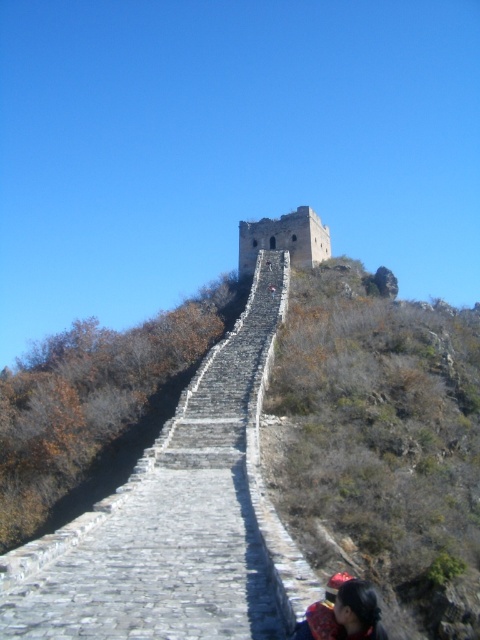
You are a hiker standing at the lower right of the image, near the dark brown hair at lower right. You want to reach the stone wall at upper center. Which direction should you move to get there?

The stone wall at upper center is positioned on the right side of dark brown hair at lower right. To reach it, you should move towards the right direction from your current position near the dark brown hair at lower right.

Based on the photo, you are a hiker standing at the base of the Great Wall and want to reach the watchtower at the top. You notice the stone wall at upper center and the dark brown hair at lower right. Which object is taller and could potentially block your view of the watchtower?

The stone wall at upper center is much taller than the dark brown hair at lower right, so it could potentially block your view of the watchtower.

You are a tourist standing on the Great Wall of China and see the stone wall at upper center and the dark brown hair at lower right. Which object is closer to you?

The dark brown hair at lower right is behind the stone wall at upper center, so the stone wall at upper center is closer to you.